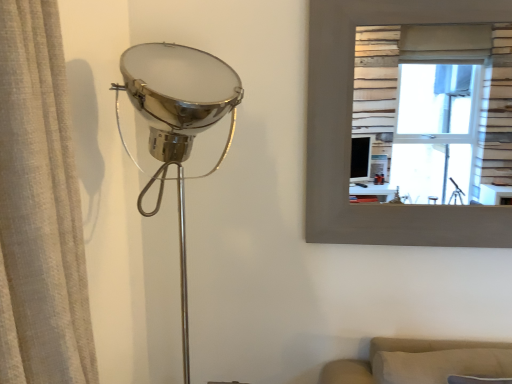
Measure the distance between matte gray mirror at upper right and camera.

3.75 meters.

This screenshot has width=512, height=384. Describe the element at coordinates (435, 104) in the screenshot. I see `matte gray mirror at upper right` at that location.

At what (x,y) coordinates should I click in order to perform the action: click on matte gray mirror at upper right. Please return your answer as a coordinate pair (x, y). This screenshot has width=512, height=384. Looking at the image, I should click on (435, 104).

Where is `matte gray mirror at upper right`? This screenshot has width=512, height=384. matte gray mirror at upper right is located at coordinates (435, 104).